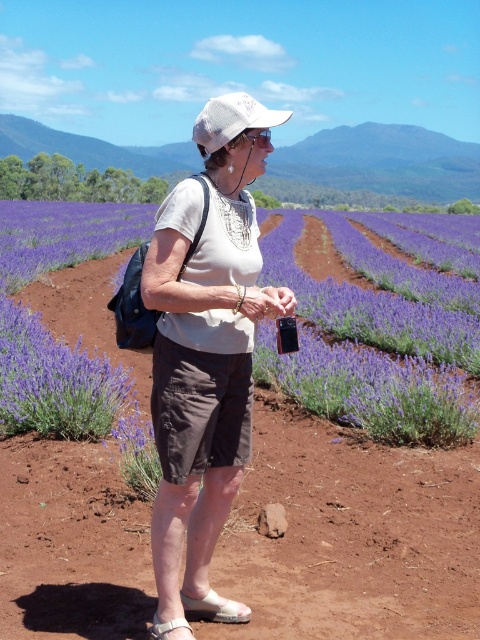
Question: From the image, what is the correct spatial relationship of matte white hat at center in relation to purple soft lavender at center?

Choices:
 (A) below
 (B) above

Answer: (A)

Question: Which is nearer to the brown soil at center?

Choices:
 (A) purple soft lavender at center
 (B) matte white hat at center

Answer: (A)

Question: Can you confirm if purple soft lavender at center is wider than white textured baseball cap at center?

Choices:
 (A) yes
 (B) no

Answer: (A)

Question: Is purple soft lavender at center thinner than white textured baseball cap at center?

Choices:
 (A) yes
 (B) no

Answer: (B)

Question: Which point is closer to the camera?

Choices:
 (A) matte white hat at center
 (B) brown soil at center
 (C) purple soft lavender at center
 (D) white textured baseball cap at center

Answer: (A)

Question: Which object is closer to the camera taking this photo?

Choices:
 (A) brown soil at center
 (B) matte white hat at center
 (C) purple soft lavender at center
 (D) white textured baseball cap at center

Answer: (B)